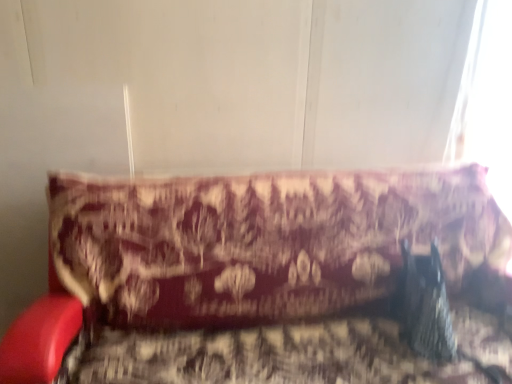
Describe the element at coordinates (262, 279) in the screenshot. I see `velvet-like fabric cushion at center` at that location.

At what (x,y) coordinates should I click in order to perform the action: click on velvet-like fabric cushion at center. Please return your answer as a coordinate pair (x, y). Looking at the image, I should click on (262, 279).

In order to face velvet-like fabric cushion at center, should I rotate leftwards or rightwards?

You should look right and rotate roughly 7.013 degrees.

I want to click on velvet-like fabric cushion at center, so click(262, 279).